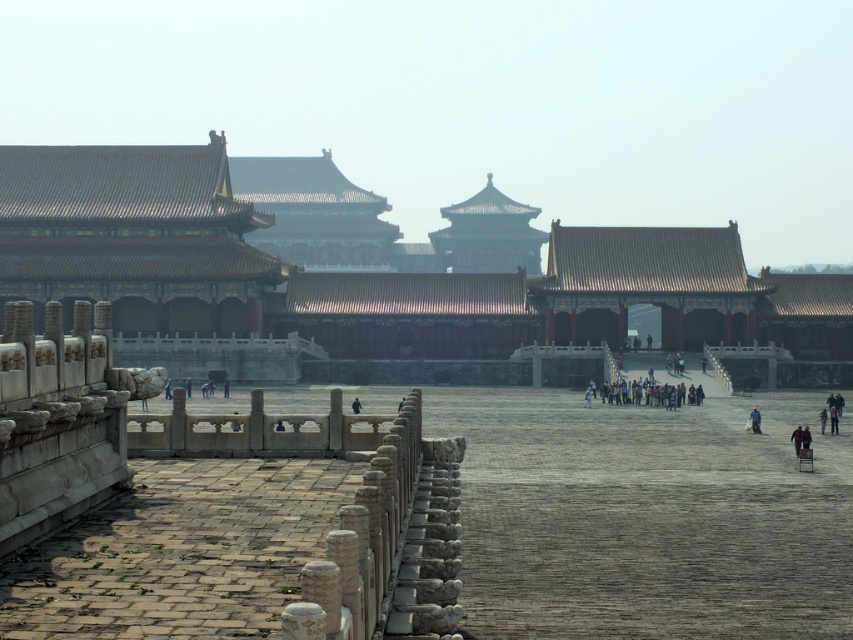
Consider the image. You are standing at the entrance of the courtyard in the Forbidden City. You see a point marked at coordinates [656,394]. What is located at that point?

The point at coordinates [656,394] indicates dark gray stone people at center.